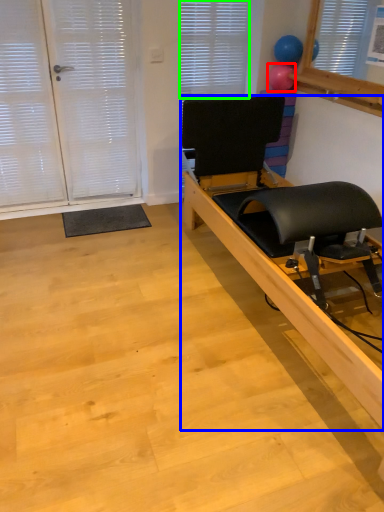
Question: Which object is the closest to the balloon (highlighted by a red box)? Choose among these: furniture (highlighted by a blue box) or blind (highlighted by a green box).

Choices:
 (A) furniture
 (B) blind

Answer: (B)